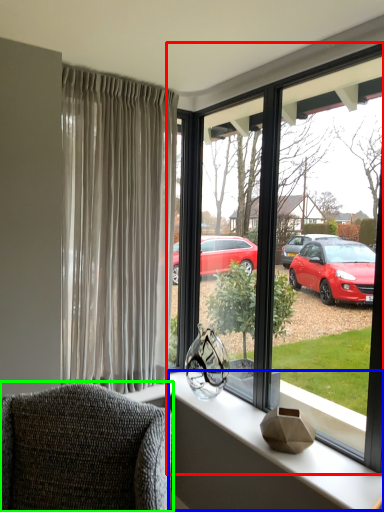
Question: Which object is the closest to the window (highlighted by a red box)? Choose among these: window sill (highlighted by a blue box) or chair (highlighted by a green box).

Choices:
 (A) window sill
 (B) chair

Answer: (A)